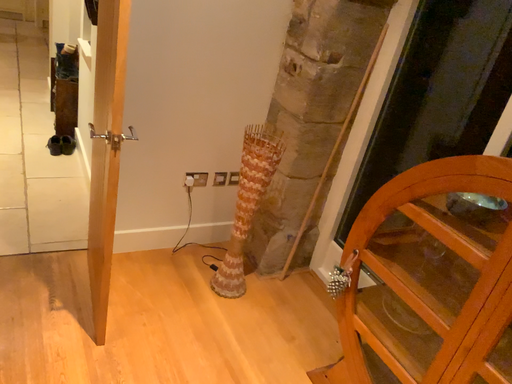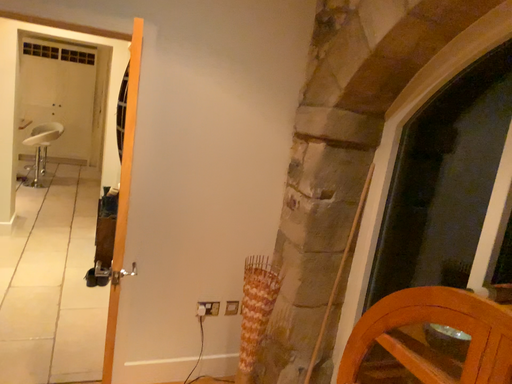
Question: How did the camera likely rotate when shooting the video?

Choices:
 (A) rotated right
 (B) rotated left

Answer: (B)